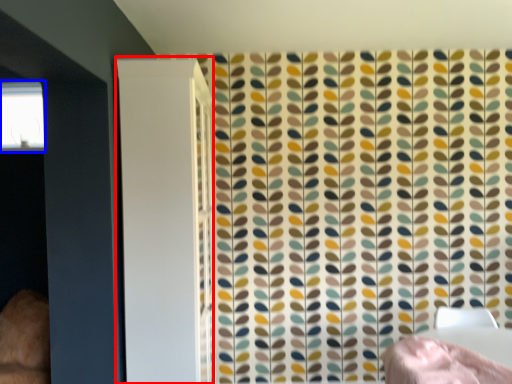
Question: Which object appears closest to the camera in this image, screen door (highlighted by a red box) or window (highlighted by a blue box)?

Choices:
 (A) screen door
 (B) window

Answer: (A)